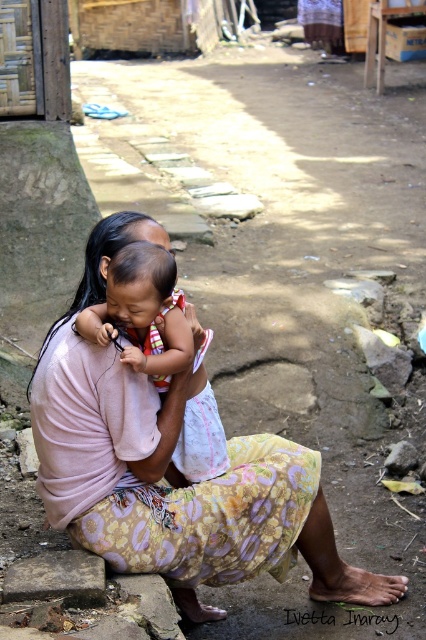
You are a photographer trying to capture the baby in the center of the image. You notice there are two babies mentioned in the scene. Which baby is closer to you, the photographer, the patterned fabric baby at center or the soft pink fabric baby at center?

The patterned fabric baby at center is closer to you because it is further to the viewer than the soft pink fabric baby at center.

You are a photographer setting up for a photo session. You need to position a light source so that it illuminates both the patterned fabric baby at center and the soft pink fabric baby at center without causing harsh shadows. Considering their sizes, which baby should be placed closer to the light to ensure even lighting?

The soft pink fabric baby at center should be placed closer to the light source because it is smaller in height compared to the patterned fabric baby at center, ensuring both receive adequate light without harsh shadows.